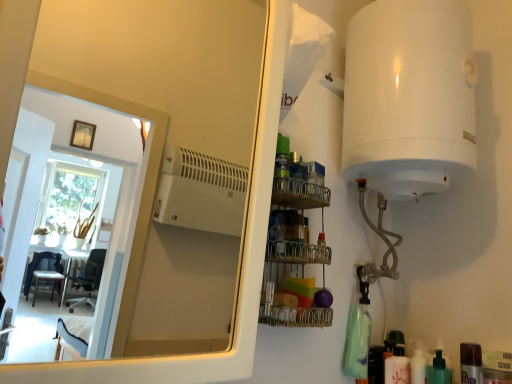
Measure the distance between point (466, 369) and camera.

The depth of point (466, 369) is 3.44 feet.

This screenshot has height=384, width=512. What do you see at coordinates (291, 258) in the screenshot?
I see `metallic wire rack at center` at bounding box center [291, 258].

At what (x,y) coordinates should I click in order to perform the action: click on white glossy bottle at lower right, the second toiletry positioned from the left. Please return your answer as a coordinate pair (x, y). Looking at the image, I should click on (418, 365).

Locate an element on the screen. The height and width of the screenshot is (384, 512). translucent plastic bottle at lower right, the 1th toiletry positioned from the right is located at coordinates (470, 363).

The height and width of the screenshot is (384, 512). I want to click on the 3rd toiletry below the white glossy mirror at upper left (from a real-world perspective), so click(418, 365).

From a real-world perspective, which object stands above the other?

white glossy mirror at upper left, from a real-world perspective.

Do you think white glossy mirror at upper left is within white glossy bottle at lower right, the second toiletry positioned from the left, or outside of it?

white glossy mirror at upper left cannot be found inside white glossy bottle at lower right, the second toiletry positioned from the left.

What's the angular difference between white glossy mirror at upper left and white glossy bottle at lower right, the third toiletry from the right,'s facing directions?

They differ by 85.8 degrees in their facing directions.

Which object is positioned more to the right, metallic wire rack at center or translucent plastic bottle at lower right, the 1th toiletry positioned from the right?

Positioned to the right is translucent plastic bottle at lower right, the 1th toiletry positioned from the right.

Which of these two, metallic wire rack at center or translucent plastic bottle at lower right, the 1th toiletry positioned from the right, is smaller?

Smaller between the two is translucent plastic bottle at lower right, the 1th toiletry positioned from the right.

How much distance is there between metallic wire rack at center and translucent plastic bottle at lower right, which is the fourth toiletry in left-to-right order?

metallic wire rack at center and translucent plastic bottle at lower right, which is the fourth toiletry in left-to-right order, are 19.75 inches apart from each other.

Looking at this image, considering the sizes of objects metallic wire rack at center and translucent plastic bottle at lower right, which is the fourth toiletry in left-to-right order, in the image provided, who is thinner, metallic wire rack at center or translucent plastic bottle at lower right, which is the fourth toiletry in left-to-right order,?

Thinner between the two is translucent plastic bottle at lower right, which is the fourth toiletry in left-to-right order.

Based on their positions, is white glossy bottle at lower right, the third toiletry from the right, located to the left or right of translucent plastic bottle at lower right, the fourth toiletry from the right?

white glossy bottle at lower right, the third toiletry from the right, is to the right of translucent plastic bottle at lower right, the fourth toiletry from the right.

Does point (417, 344) come behind point (385, 363)?

Yes, it is.

Is white glossy bottle at lower right, the third toiletry from the right, not inside translucent plastic bottle at lower right, the fourth toiletry from the right?

white glossy bottle at lower right, the third toiletry from the right, is positioned outside translucent plastic bottle at lower right, the fourth toiletry from the right.

In the scene shown: Is translucent plastic bottle at lower right, the fourth toiletry from the right, at the left side of white glossy bottle at lower right, the third toiletry from the right?

Correct, you'll find translucent plastic bottle at lower right, the fourth toiletry from the right, to the left of white glossy bottle at lower right, the third toiletry from the right.

Who is bigger, translucent plastic bottle at lower right, the fourth toiletry from the right, or white glossy bottle at lower right, the second toiletry positioned from the left?

translucent plastic bottle at lower right, the fourth toiletry from the right.

How different are the orientations of translucent plastic bottle at lower right, the fourth toiletry from the right, and white glossy bottle at lower right, the third toiletry from the right, in degrees?

The angular difference between translucent plastic bottle at lower right, the fourth toiletry from the right, and white glossy bottle at lower right, the third toiletry from the right, is 0.000123 degrees.

Which is in front, translucent plastic bottle at lower right, the fourth toiletry from the right, or white glossy bottle at lower right, the third toiletry from the right?

white glossy bottle at lower right, the third toiletry from the right, is more forward.

Does metallic wire rack at center turn towards white glossy bottle at lower right, the third toiletry from the right?

No, metallic wire rack at center does not turn towards white glossy bottle at lower right, the third toiletry from the right.

Is metallic wire rack at center bigger than white glossy bottle at lower right, the third toiletry from the right?

Yes.

From the picture: Is metallic wire rack at center touching white glossy bottle at lower right, the third toiletry from the right?

No, metallic wire rack at center is not in contact with white glossy bottle at lower right, the third toiletry from the right.

From a real-world perspective, is metallic wire rack at center above or below white glossy bottle at lower right, the third toiletry from the right?

Clearly, from a real-world perspective, metallic wire rack at center is above white glossy bottle at lower right, the third toiletry from the right.

Consider the image. Is green matte pump bottle at lower right, arranged as the 2th toiletry when viewed from the right, far away from white glossy mirror at upper left?

green matte pump bottle at lower right, arranged as the 2th toiletry when viewed from the right, is positioned a significant distance from white glossy mirror at upper left.

Is point (435, 371) closer or farther from the camera than point (225, 56)?

Point (435, 371) is positioned closer to the camera compared to point (225, 56).

Visually, is green matte pump bottle at lower right, which is the 3th toiletry in left-to-right order, positioned to the left or to the right of white glossy mirror at upper left?

In the image, green matte pump bottle at lower right, which is the 3th toiletry in left-to-right order, appears on the right side of white glossy mirror at upper left.

Can you tell me how much green matte pump bottle at lower right, arranged as the 2th toiletry when viewed from the right, and white glossy mirror at upper left differ in facing direction?

There is a 85.8-degree angle between the facing directions of green matte pump bottle at lower right, arranged as the 2th toiletry when viewed from the right, and white glossy mirror at upper left.

From the image's perspective, is translucent plastic bottle at lower right, which is the fourth toiletry in left-to-right order, on white glossy mirror at upper left?

No, from the image's perspective, translucent plastic bottle at lower right, which is the fourth toiletry in left-to-right order, is not on top of white glossy mirror at upper left.

Where is `the 4th toiletry counting from the right side of the white glossy mirror at upper left`? This screenshot has height=384, width=512. the 4th toiletry counting from the right side of the white glossy mirror at upper left is located at coordinates (470, 363).

Which is in front, point (472, 381) or point (197, 323)?

The point (472, 381) is in front.

This screenshot has height=384, width=512. What are the coordinates of `toiletry that is the 2nd one when counting rightward from the white glossy mirror at upper left` in the screenshot? It's located at (418, 365).

Where is `shelf located above the translucent plastic bottle at lower right, which is the fourth toiletry in left-to-right order (from a real-world perspective)`? shelf located above the translucent plastic bottle at lower right, which is the fourth toiletry in left-to-right order (from a real-world perspective) is located at coordinates (291, 258).

Estimate the real-world distances between objects in this image. Which object is further from green matte pump bottle at lower right, arranged as the 2th toiletry when viewed from the right, metallic wire rack at center or translucent plastic bottle at lower right, the 1th toiletry positioned from the right?

metallic wire rack at center is positioned further to the anchor green matte pump bottle at lower right, arranged as the 2th toiletry when viewed from the right.

Which object lies further to the anchor point translucent plastic bottle at lower right, which appears as the 1th toiletry when viewed from the left, green matte pump bottle at lower right, arranged as the 2th toiletry when viewed from the right, or white glossy bottle at lower right, the third toiletry from the right?

Among the two, green matte pump bottle at lower right, arranged as the 2th toiletry when viewed from the right, is located further to translucent plastic bottle at lower right, which appears as the 1th toiletry when viewed from the left.

Based on their spatial positions, is translucent plastic bottle at lower right, which appears as the 1th toiletry when viewed from the left, or white glossy mirror at upper left closer to white glossy bottle at lower right, the second toiletry positioned from the left?

Among the two, translucent plastic bottle at lower right, which appears as the 1th toiletry when viewed from the left, is located nearer to white glossy bottle at lower right, the second toiletry positioned from the left.

Looking at the image, which one is located closer to translucent plastic bottle at lower right, the 1th toiletry positioned from the right, green matte pump bottle at lower right, which is the 3th toiletry in left-to-right order, or translucent plastic bottle at lower right, which appears as the 1th toiletry when viewed from the left?

green matte pump bottle at lower right, which is the 3th toiletry in left-to-right order, is closer to translucent plastic bottle at lower right, the 1th toiletry positioned from the right.

Looking at the image, which one is located further to green matte pump bottle at lower right, which is the 3th toiletry in left-to-right order, translucent plastic bottle at lower right, the fourth toiletry from the right, or white glossy bottle at lower right, the second toiletry positioned from the left?

Based on the image, translucent plastic bottle at lower right, the fourth toiletry from the right, appears to be further to green matte pump bottle at lower right, which is the 3th toiletry in left-to-right order.

Considering their positions, is white glossy bottle at lower right, the third toiletry from the right, positioned closer to green matte pump bottle at lower right, which is the 3th toiletry in left-to-right order, than translucent plastic bottle at lower right, the 1th toiletry positioned from the right?

white glossy bottle at lower right, the third toiletry from the right, lies closer to green matte pump bottle at lower right, which is the 3th toiletry in left-to-right order, than the other object.

Estimate the real-world distances between objects in this image. Which object is further from translucent plastic bottle at lower right, which appears as the 1th toiletry when viewed from the left, white glossy mirror at upper left or translucent plastic bottle at lower right, the 1th toiletry positioned from the right?

white glossy mirror at upper left is further to translucent plastic bottle at lower right, which appears as the 1th toiletry when viewed from the left.

Based on their spatial positions, is metallic wire rack at center or translucent plastic bottle at lower right, the fourth toiletry from the right, closer to white glossy bottle at lower right, the third toiletry from the right?

translucent plastic bottle at lower right, the fourth toiletry from the right, is positioned closer to the anchor white glossy bottle at lower right, the third toiletry from the right.

The image size is (512, 384). I want to click on shelf located between white glossy mirror at upper left and translucent plastic bottle at lower right, the 1th toiletry positioned from the right, in the left-right direction, so click(291, 258).

Where is `shelf located between white glossy mirror at upper left and green matte pump bottle at lower right, which is the 3th toiletry in left-to-right order, in the depth direction`? shelf located between white glossy mirror at upper left and green matte pump bottle at lower right, which is the 3th toiletry in left-to-right order, in the depth direction is located at coordinates (291, 258).

This screenshot has width=512, height=384. What are the coordinates of `shelf between white glossy mirror at upper left and translucent plastic bottle at lower right, the fourth toiletry from the right, from front to back` in the screenshot? It's located at (291, 258).

Identify the location of toiletry positioned between translucent plastic bottle at lower right, the 1th toiletry positioned from the right, and white glossy bottle at lower right, the second toiletry positioned from the left, from near to far. (438, 370).